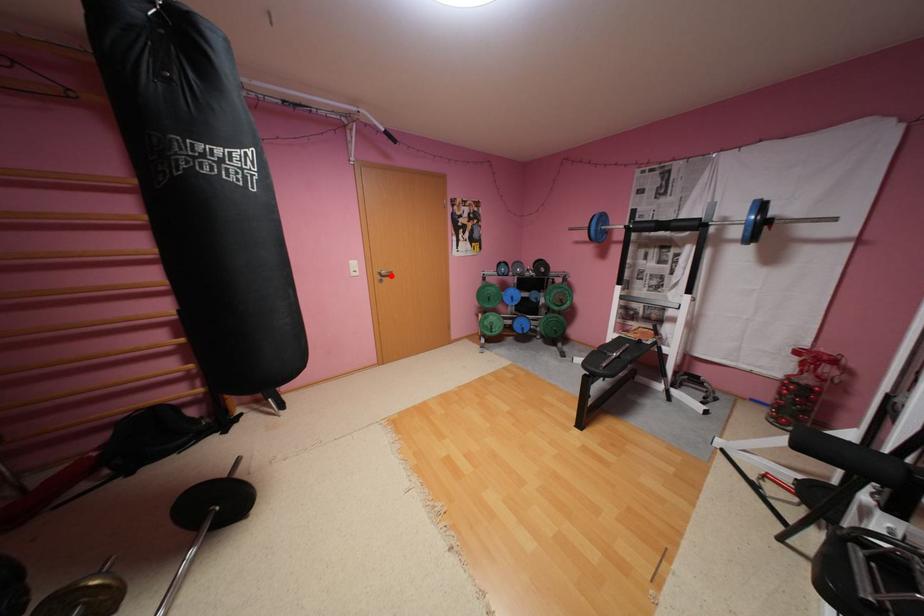
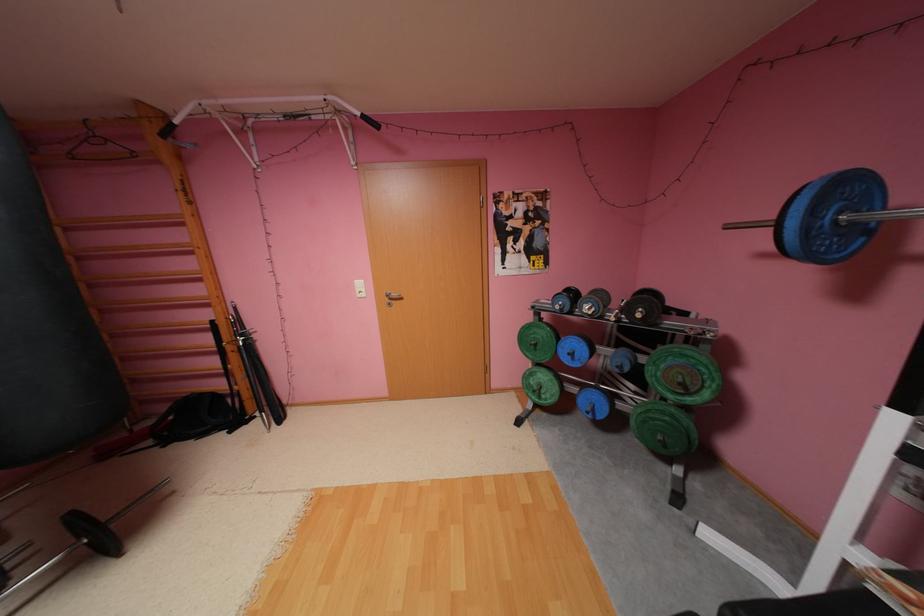
Locate, in the second image, the point that corresponds to the highlighted location in the first image.

(399, 299)